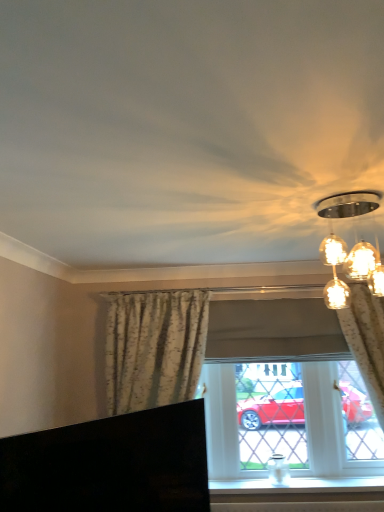
Question: Does matte glass light fixture at upper right have a greater width compared to floral fabric curtain at right, which is the second curtain in left-to-right order?

Choices:
 (A) no
 (B) yes

Answer: (B)

Question: Does matte glass light fixture at upper right touch floral fabric curtain at right, which is the second curtain in left-to-right order?

Choices:
 (A) no
 (B) yes

Answer: (A)

Question: From the image's perspective, is matte glass light fixture at upper right beneath floral fabric curtain at right, which is the second curtain in left-to-right order?

Choices:
 (A) no
 (B) yes

Answer: (A)

Question: Considering the relative sizes of matte glass light fixture at upper right and floral fabric curtain at right, the 1th curtain when ordered from right to left, in the image provided, is matte glass light fixture at upper right taller than floral fabric curtain at right, the 1th curtain when ordered from right to left,?

Choices:
 (A) yes
 (B) no

Answer: (B)

Question: Would you say floral fabric curtain at right, the 1th curtain when ordered from right to left, is part of matte glass light fixture at upper right's contents?

Choices:
 (A) yes
 (B) no

Answer: (B)

Question: Considering the relative sizes of matte glass light fixture at upper right and floral fabric curtain at right, which is the second curtain in left-to-right order, in the image provided, is matte glass light fixture at upper right thinner than floral fabric curtain at right, which is the second curtain in left-to-right order,?

Choices:
 (A) no
 (B) yes

Answer: (A)

Question: Is black glossy tv at lower left thinner than matte floral curtains at center?

Choices:
 (A) yes
 (B) no

Answer: (B)

Question: Could matte floral curtains at center be considered to be inside black glossy tv at lower left?

Choices:
 (A) yes
 (B) no

Answer: (B)

Question: Can you confirm if black glossy tv at lower left is smaller than matte floral curtains at center?

Choices:
 (A) no
 (B) yes

Answer: (B)

Question: From the image's perspective, is black glossy tv at lower left beneath matte floral curtains at center?

Choices:
 (A) yes
 (B) no

Answer: (A)

Question: Is black glossy tv at lower left outside matte floral curtains at center?

Choices:
 (A) yes
 (B) no

Answer: (A)

Question: Is black glossy tv at lower left wider than matte floral curtains at center?

Choices:
 (A) yes
 (B) no

Answer: (A)

Question: Can you confirm if floral fabric curtain at center, the 2th curtain in the right-to-left sequence, is thinner than matte floral curtains at center?

Choices:
 (A) no
 (B) yes

Answer: (A)